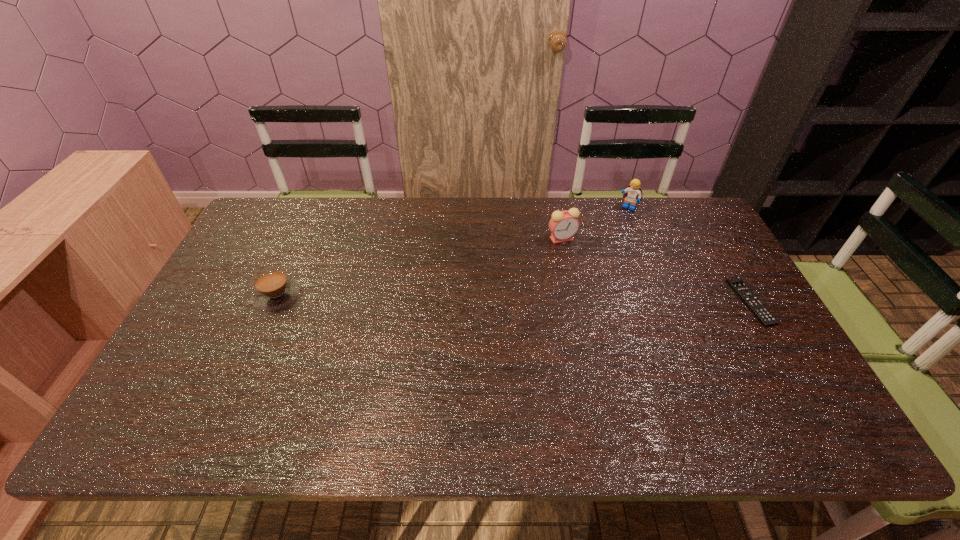
The height and width of the screenshot is (540, 960). Find the location of `vacant space on the desktop that is between the cappuccino and the rightmost object and is positioned on the face of the third object from right to left`. vacant space on the desktop that is between the cappuccino and the rightmost object and is positioned on the face of the third object from right to left is located at coordinates (532, 299).

At what (x,y) coordinates should I click in order to perform the action: click on vacant spot on the desktop that is between the second shortest object and the shortest object and is positioned on the front-facing side of the Lego. Please return your answer as a coordinate pair (x, y). The width and height of the screenshot is (960, 540). Looking at the image, I should click on (571, 299).